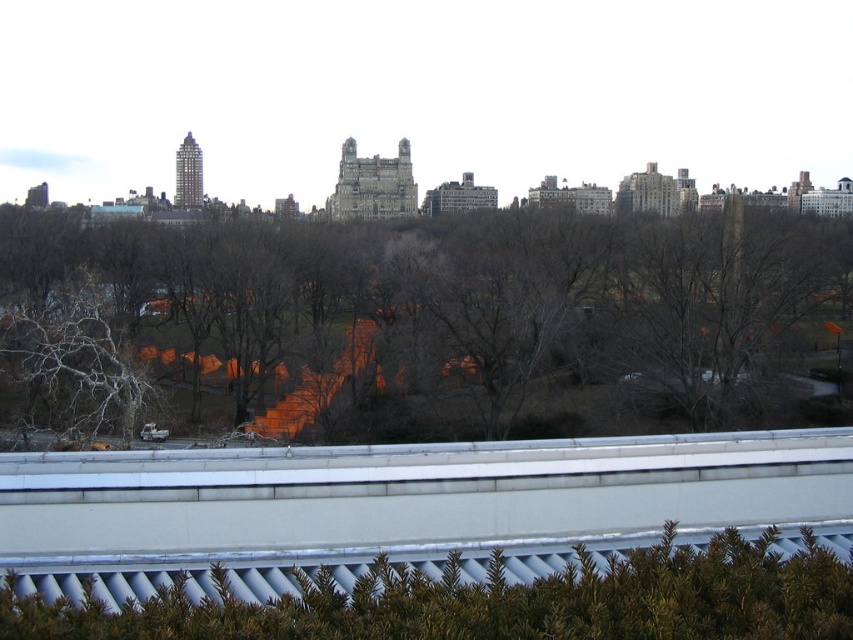
Question: Among these points, which one is farthest from the camera?

Choices:
 (A) (236, 604)
 (B) (252, 385)

Answer: (B)

Question: Can you confirm if brown leafless tree at center is positioned to the left of green textured hedge at lower center?

Choices:
 (A) yes
 (B) no

Answer: (A)

Question: Which point appears farthest from the camera in this image?

Choices:
 (A) (192, 609)
 (B) (831, 401)

Answer: (B)

Question: Does brown leafless tree at center have a lesser width compared to green textured hedge at lower center?

Choices:
 (A) no
 (B) yes

Answer: (A)

Question: Is brown leafless tree at center behind green textured hedge at lower center?

Choices:
 (A) yes
 (B) no

Answer: (A)